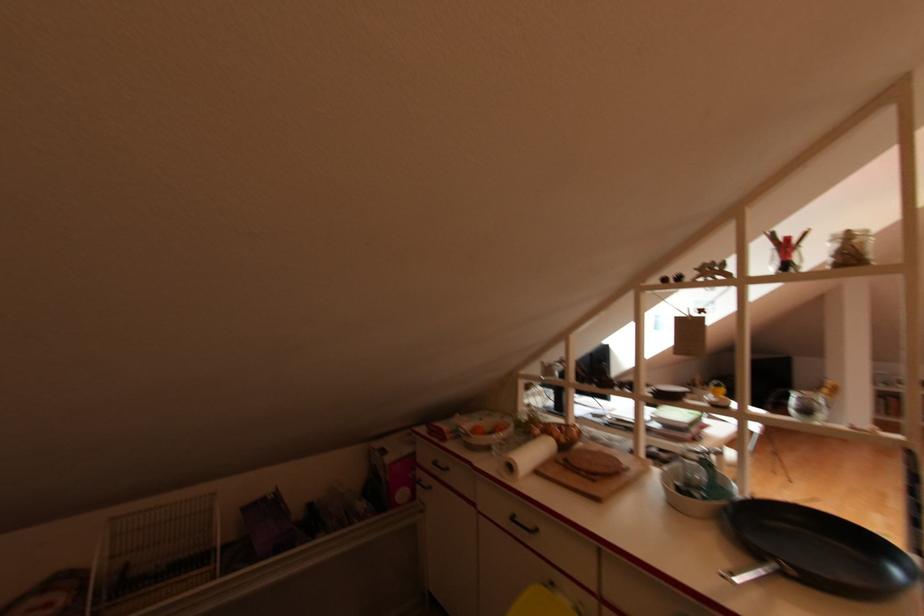
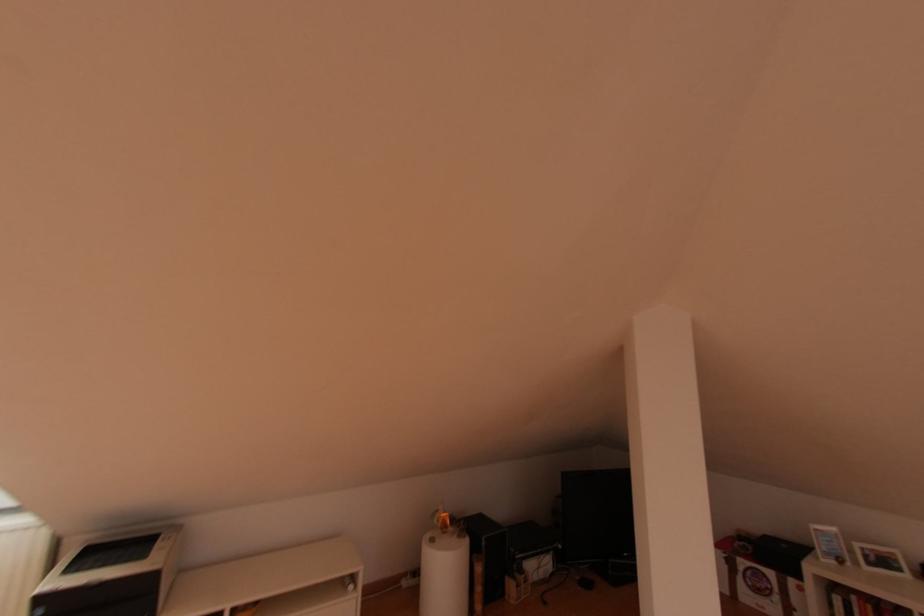
The point at (885, 385) is marked in the first image. Where is the corresponding point in the second image?

(840, 562)